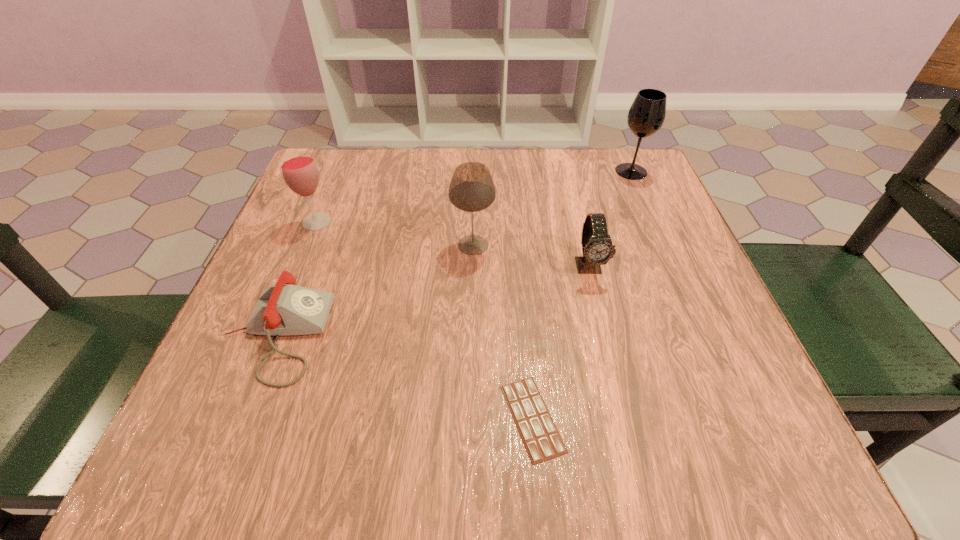
I want to click on free spot that satisfies the following two spatial constraints: 1. on the back side of the rightmost object; 2. on the right side of the leftmost wineglass, so click(x=337, y=171).

The image size is (960, 540). What are the coordinates of `vacant region that satisfies the following two spatial constraints: 1. on the back side of the shortest object; 2. on the dial of the fifth tallest object` in the screenshot? It's located at (525, 335).

This screenshot has width=960, height=540. I want to click on vacant space that satisfies the following two spatial constraints: 1. on the face of the fourth tallest object; 2. on the dial of the telephone, so click(606, 335).